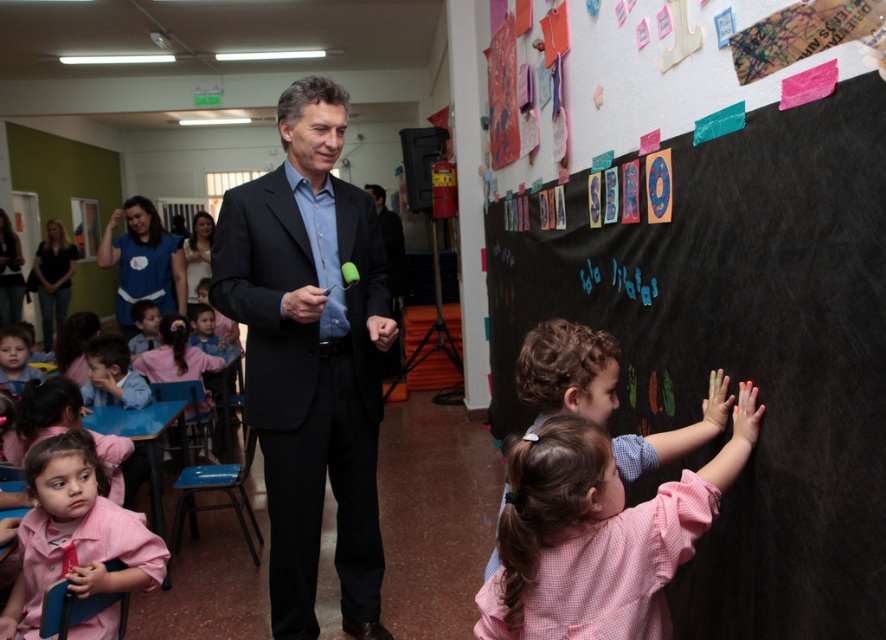
Question: Does black chalkboard at center have a larger size compared to matte black suit at center?

Choices:
 (A) yes
 (B) no

Answer: (A)

Question: Estimate the real-world distances between objects in this image. Which object is closer to the matte black suit at center?

Choices:
 (A) blue fabric shirt at upper left
 (B) black chalkboard at center
 (C) pink checkered shirt at lower left

Answer: (C)

Question: Which object appears closest to the camera in this image?

Choices:
 (A) matte black suit at center
 (B) pink checkered shirt at lower left
 (C) pink gingham shirt at center

Answer: (C)

Question: Does black chalkboard at center have a greater width compared to pink checkered shirt at lower left?

Choices:
 (A) no
 (B) yes

Answer: (A)

Question: Does matte black suit at center have a lesser width compared to pink gingham shirt at center?

Choices:
 (A) yes
 (B) no

Answer: (B)

Question: Based on their relative distances, which object is farther from the pink gingham shirt at center?

Choices:
 (A) black chalkboard at center
 (B) matte black suit at center
 (C) pink checkered shirt at lower left
 (D) blue fabric shirt at upper left

Answer: (D)